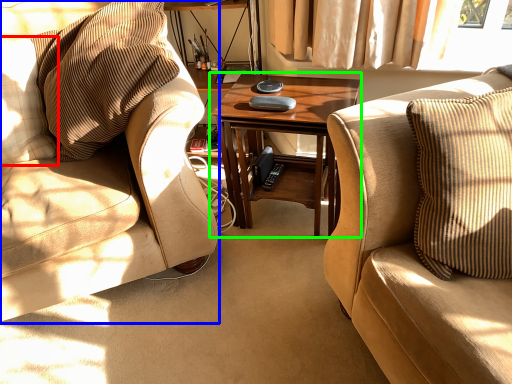
Question: Which object is positioned farthest from pillow (highlighted by a red box)? Select from chair (highlighted by a blue box) and coffee table (highlighted by a green box).

Choices:
 (A) chair
 (B) coffee table

Answer: (B)